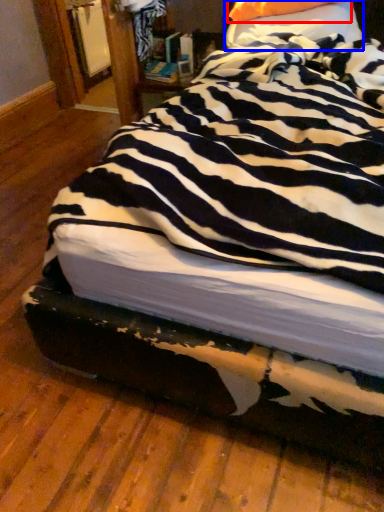
Question: Among these objects, which one is nearest to the camera, pillow (highlighted by a red box) or pillow (highlighted by a blue box)?

Choices:
 (A) pillow
 (B) pillow

Answer: (B)